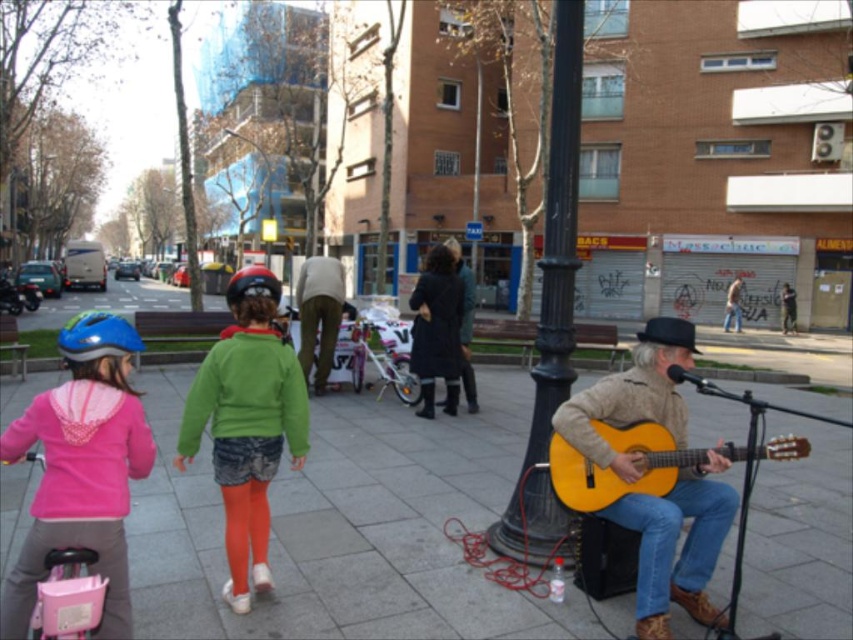
You are a passerby walking along the street and notice the green matte sweater at center and the yellow matte guitar at lower right. Which object is positioned more to the right side of the scene?

The yellow matte guitar at lower right is positioned more to the right side of the scene than the green matte sweater at center.

You are standing at the camera position and want to pick up an item. There are two points marked in the scene, point A at coordinates point (103,611) and point B at coordinates point (132,342). Which point is closer to you?

Point A at coordinates point (103,611) is closer to the camera than point B at coordinates point (132,342).

You are standing at the point marked as point [263,440] in the image. You want to walk towards the modern glass building on the left. Is the modern glass building on the left within your line of sight from this position?

The distance between point [263,440] and the viewer is 11.32 feet. Since the modern glass building on the left is in the background, it should be visible in your line of sight from that position.